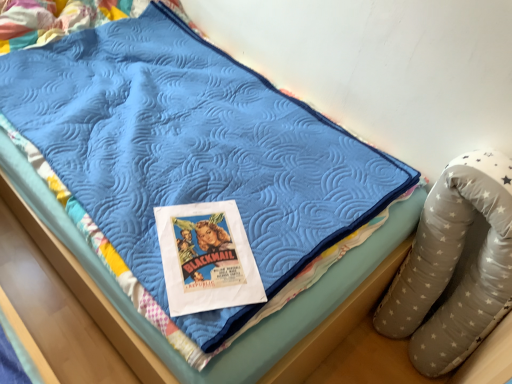
Question: Does gray star-patterned bean bag chair at right have a greater height compared to matte paper poster at center?

Choices:
 (A) yes
 (B) no

Answer: (A)

Question: Is gray star-patterned bean bag chair at right bigger than matte paper poster at center?

Choices:
 (A) yes
 (B) no

Answer: (A)

Question: From a real-world perspective, is gray star-patterned bean bag chair at right physically below matte paper poster at center?

Choices:
 (A) yes
 (B) no

Answer: (A)

Question: Is the surface of gray star-patterned bean bag chair at right in direct contact with matte paper poster at center?

Choices:
 (A) no
 (B) yes

Answer: (A)

Question: Does gray star-patterned bean bag chair at right have a lesser height compared to matte paper poster at center?

Choices:
 (A) no
 (B) yes

Answer: (A)

Question: Are gray star-patterned bean bag chair at right and matte paper poster at center far apart?

Choices:
 (A) no
 (B) yes

Answer: (A)

Question: Does matte paper poster at center turn towards gray star-patterned bean bag chair at right?

Choices:
 (A) yes
 (B) no

Answer: (B)

Question: Is matte paper poster at center beside gray star-patterned bean bag chair at right?

Choices:
 (A) yes
 (B) no

Answer: (B)

Question: From the image's perspective, is matte paper poster at center beneath gray star-patterned bean bag chair at right?

Choices:
 (A) no
 (B) yes

Answer: (A)

Question: Considering the relative sizes of matte paper poster at center and gray star-patterned bean bag chair at right in the image provided, is matte paper poster at center smaller than gray star-patterned bean bag chair at right?

Choices:
 (A) yes
 (B) no

Answer: (A)

Question: Can you confirm if matte paper poster at center is shorter than gray star-patterned bean bag chair at right?

Choices:
 (A) yes
 (B) no

Answer: (A)

Question: From the image's perspective, would you say matte paper poster at center is positioned over gray star-patterned bean bag chair at right?

Choices:
 (A) no
 (B) yes

Answer: (B)

Question: From the image's perspective, relative to matte paper poster at center, is gray star-patterned bean bag chair at right above or below?

Choices:
 (A) below
 (B) above

Answer: (A)